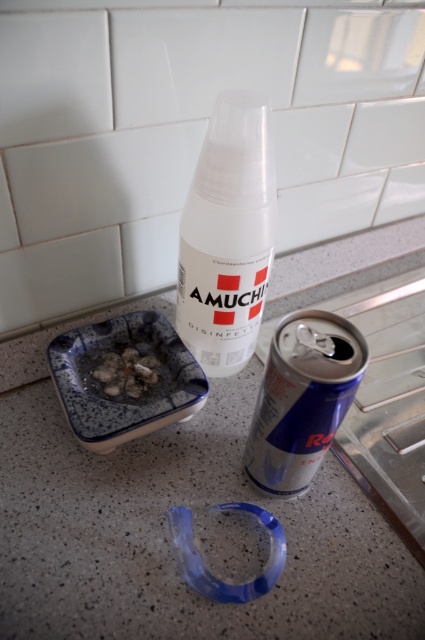
Question: Can you confirm if blue metallic can at center is positioned to the right of white crumbly food at center?

Choices:
 (A) yes
 (B) no

Answer: (A)

Question: Which object is closer to the camera taking this photo?

Choices:
 (A) white crumbly food at center
 (B) transparent plastic spray bottle at center

Answer: (B)

Question: Does blue metallic can at center appear over white crumbly food at center?

Choices:
 (A) no
 (B) yes

Answer: (A)

Question: Among these objects, which one is farthest from the camera?

Choices:
 (A) blue metallic can at center
 (B) white crumbly food at center
 (C) transparent plastic spray bottle at center

Answer: (B)

Question: Based on their relative distances, which object is nearer to the blue metallic can at center?

Choices:
 (A) transparent plastic spray bottle at center
 (B) white crumbly food at center

Answer: (A)

Question: Is transparent plastic spray bottle at center closer to camera compared to white crumbly food at center?

Choices:
 (A) yes
 (B) no

Answer: (A)